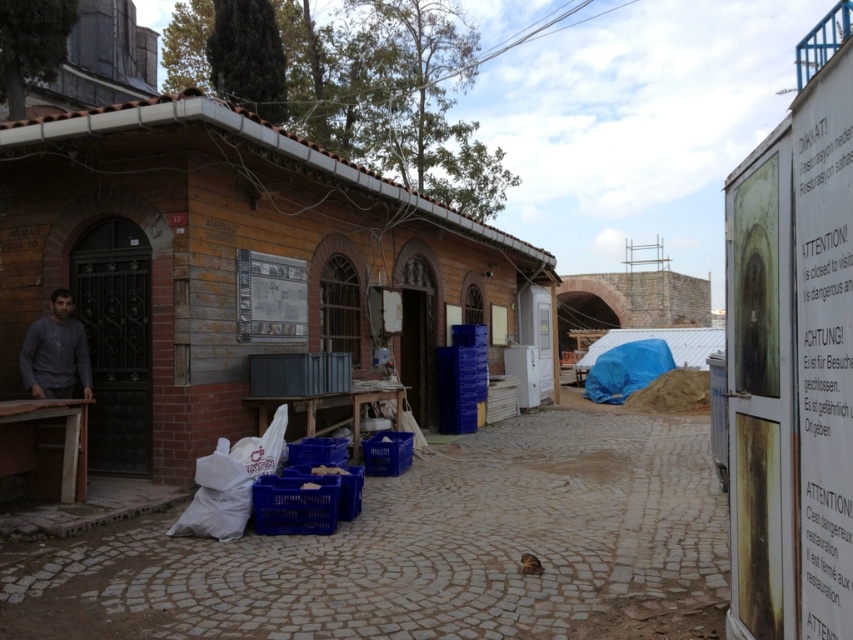
You are a delivery person carrying a large box that is 1 meter wide. You need to navigate through the smooth cobblestone alley at center and the gray matte shirt at left. Which path can accommodate your box?

The smooth cobblestone alley at center has a width larger than the gray matte shirt at left, so the box can fit through the smooth cobblestone alley at center.

You are a construction worker planning to place a safety sign on the gray matte shirt at left. Since the blue plastic crate at lower center is nearby, will the sign be visible from above the crate?

The gray matte shirt at left is above the blue plastic crate at lower center, so placing the safety sign on the gray matte shirt at left would make it visible from above the crate.